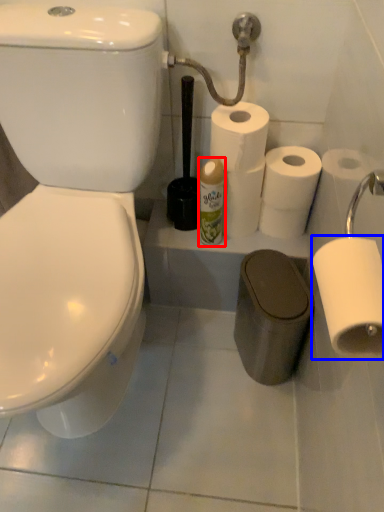
Question: Which of the following is the farthest to the observer, toiletry (highlighted by a red box) or toilet paper (highlighted by a blue box)?

Choices:
 (A) toiletry
 (B) toilet paper

Answer: (A)